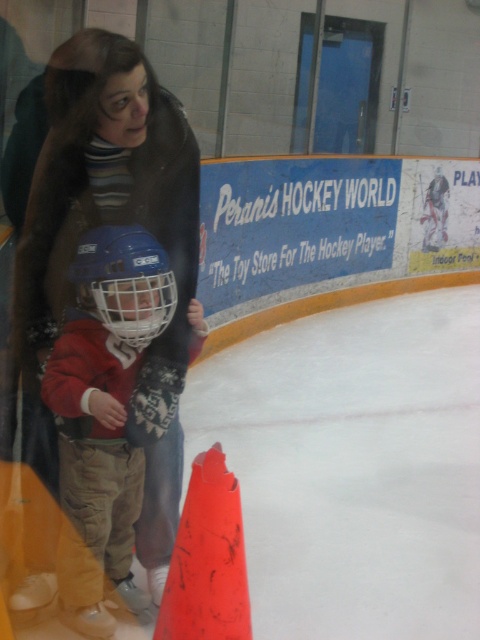
You are a coach organizing equipment in the hockey rink. You have two helmets, the matte red helmet at center and the matte blue helmet at left. Which helmet is taller?

The matte red helmet at center is much taller than the matte blue helmet at left.

You are a hockey coach observing a practice session. You notice the matte red helmet at center and the matte blue helmet at left. Which helmet would you recommend for a beginner player based on size?

The matte red helmet at center is larger in size than the matte blue helmet at left, so the matte red helmet at center would be more suitable for a beginner player who likely needs a larger size.

You are a coach at Perani Hockey Academy. You want to ensure that the safety distance between the orange matte traffic cone at lower center and the matte blue helmet at left is maintained at least 24 inches. Is the current distance sufficient?

The orange matte traffic cone at lower center is 24.31 inches away from the matte blue helmet at left, which is just over the required 24 inches. Therefore, the current distance is sufficient to meet the safety requirement.